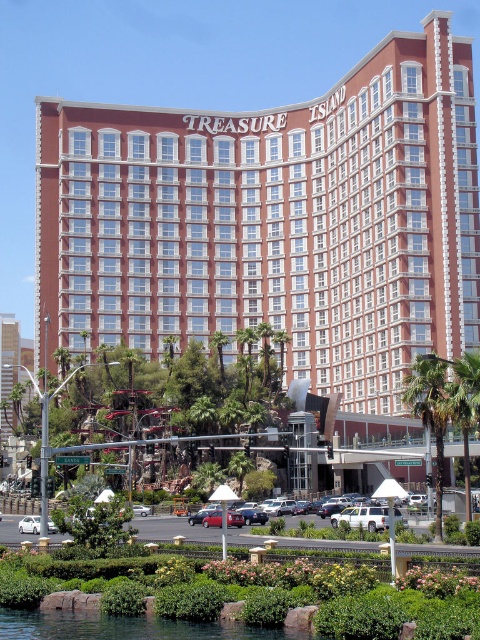
Who is positioned more to the right, red brick hotel at center or green leafy palm tree at lower right?

Positioned to the right is green leafy palm tree at lower right.

Is red brick hotel at center thinner than green leafy palm tree at lower right?

In fact, red brick hotel at center might be wider than green leafy palm tree at lower right.

Between point (78, 179) and point (465, 376), which one is positioned behind?

The point (78, 179) is behind.

Find the location of a particular element. This screenshot has height=640, width=480. red brick hotel at center is located at coordinates (273, 221).

Is green leafy palm tree at center below green leafy palm tree at lower right?

Yes.

Which is above, green leafy palm tree at center or green leafy palm tree at lower right?

green leafy palm tree at lower right is above.

Where is `green leafy palm tree at center`? green leafy palm tree at center is located at coordinates (431, 412).

Can you confirm if green leafy palm tree at lower right is shorter than white matte car at lower left?

No.

Between green leafy palm tree at lower right and white matte car at lower left, which one has more height?

With more height is green leafy palm tree at lower right.

At what (x,y) coordinates should I click in order to perform the action: click on green leafy palm tree at lower right. Please return your answer as a coordinate pair (x, y). The width and height of the screenshot is (480, 640). Looking at the image, I should click on (466, 406).